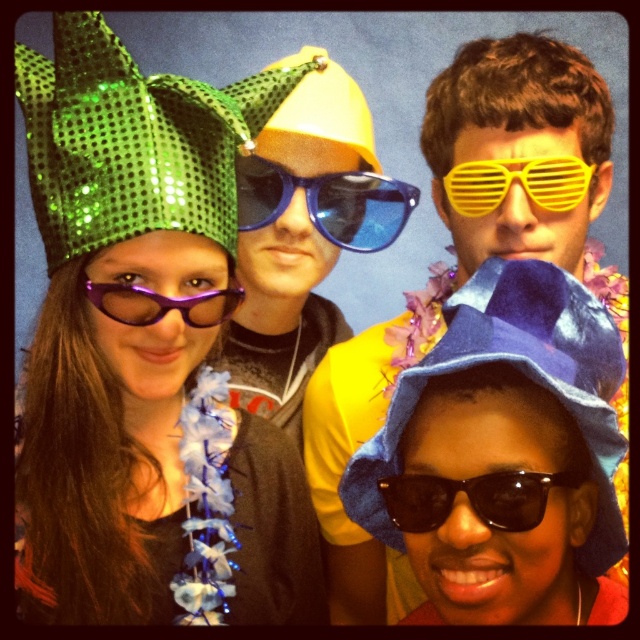
You are a photographer trying to adjust the spacing between the green sequined hat at upper left and the yellow party hat on the left. The minimum distance required between the two hats to avoid overlapping in the photo is 30 inches. Can you confirm if the current spacing allows this?

The green sequined hat at upper left and the yellow party hat on the left are 32.32 inches apart, which exceeds the minimum required distance of 30 inches. Therefore, the current spacing is sufficient to prevent overlapping in the photo.

You are a photographer trying to adjust the camera focus. You notice the green sequined hat at upper left and the purple matte goggles at left are both in the frame. Which accessory should you focus on first to ensure it appears sharp in the photo?

The green sequined hat at upper left is much taller than the purple matte goggles at left, so focusing on the taller accessory first would ensure it is sharp.